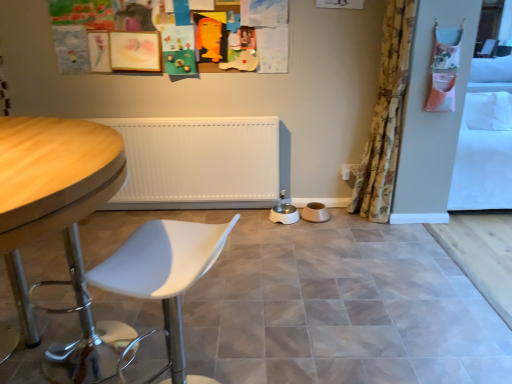
Question: Does white plastic swivel chair at lower left appear on the right side of matte ceramic tile at center?

Choices:
 (A) yes
 (B) no

Answer: (B)

Question: Does white plastic swivel chair at lower left have a larger size compared to matte ceramic tile at center?

Choices:
 (A) no
 (B) yes

Answer: (A)

Question: Is white plastic swivel chair at lower left wider than matte ceramic tile at center?

Choices:
 (A) no
 (B) yes

Answer: (A)

Question: From the image's perspective, is white plastic swivel chair at lower left on top of matte ceramic tile at center?

Choices:
 (A) no
 (B) yes

Answer: (A)

Question: Is white plastic swivel chair at lower left far away from matte ceramic tile at center?

Choices:
 (A) yes
 (B) no

Answer: (A)

Question: Could you tell me if white plastic swivel chair at lower left is turned towards matte ceramic tile at center?

Choices:
 (A) no
 (B) yes

Answer: (A)

Question: Is white plastic swivel chair at lower left positioned before floral fabric curtain at right?

Choices:
 (A) yes
 (B) no

Answer: (A)

Question: Is white plastic swivel chair at lower left surrounding floral fabric curtain at right?

Choices:
 (A) yes
 (B) no

Answer: (B)

Question: Is white plastic swivel chair at lower left to the right of floral fabric curtain at right from the viewer's perspective?

Choices:
 (A) no
 (B) yes

Answer: (A)

Question: Can you confirm if white plastic swivel chair at lower left is shorter than floral fabric curtain at right?

Choices:
 (A) yes
 (B) no

Answer: (A)

Question: Are white plastic swivel chair at lower left and floral fabric curtain at right located far from each other?

Choices:
 (A) no
 (B) yes

Answer: (B)

Question: Could you tell me if white plastic swivel chair at lower left is turned towards floral fabric curtain at right?

Choices:
 (A) no
 (B) yes

Answer: (A)

Question: From a real-world perspective, is floral fabric curtain at right physically above white plastic swivel chair at lower left?

Choices:
 (A) yes
 (B) no

Answer: (A)